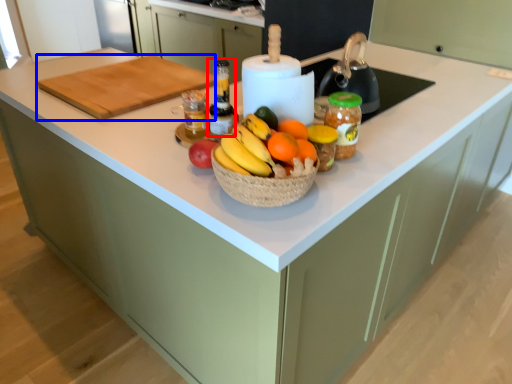
Question: Which object appears farthest to the camera in this image, bottle (highlighted by a red box) or cutting board (highlighted by a blue box)?

Choices:
 (A) bottle
 (B) cutting board

Answer: (B)